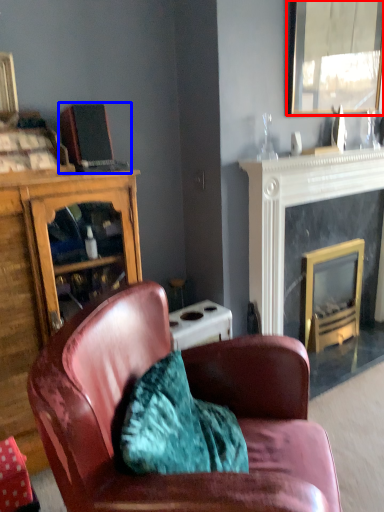
Question: Which of the following is the closest to the observer, mirror (highlighted by a red box) or laptop (highlighted by a blue box)?

Choices:
 (A) mirror
 (B) laptop

Answer: (B)